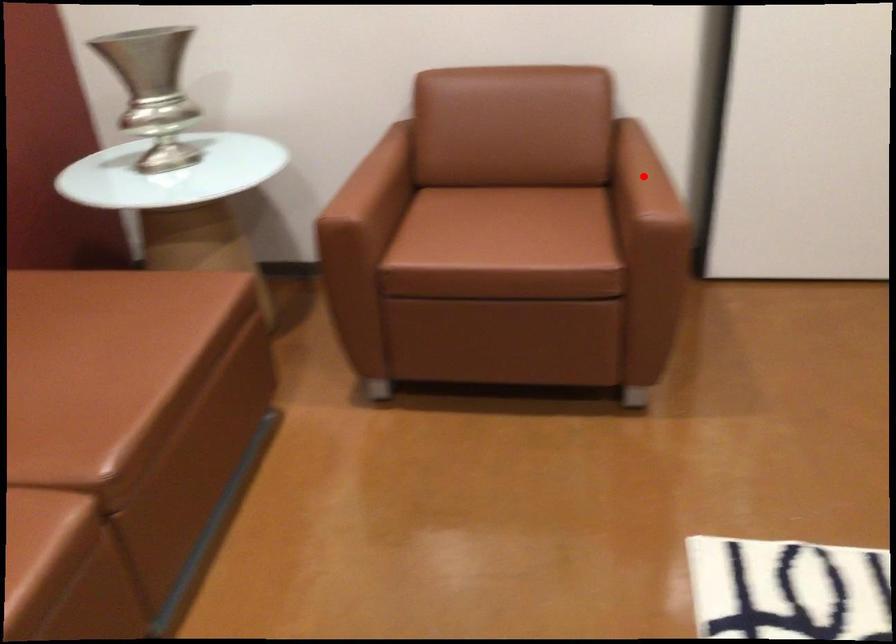
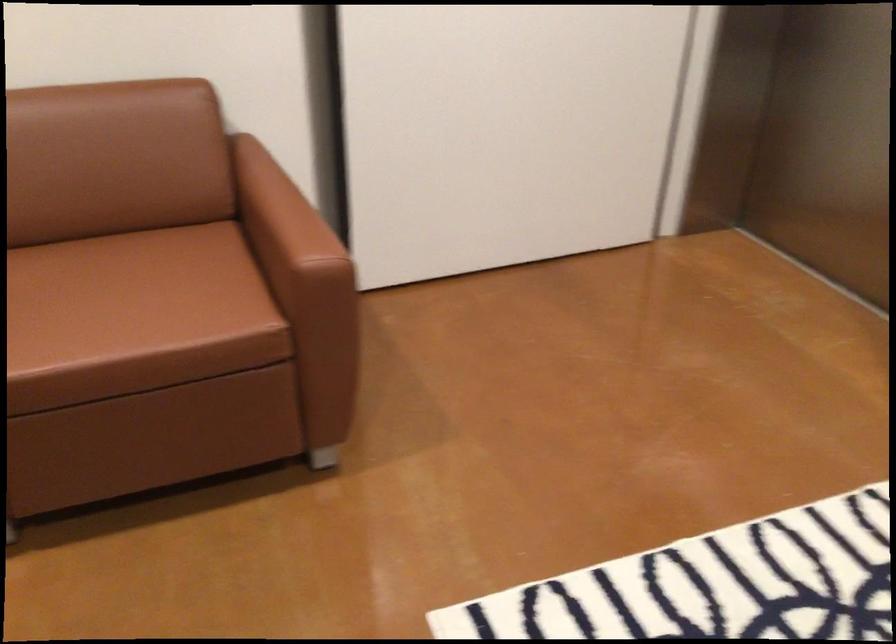
Question: I am providing you with two images of the same scene from different viewpoints. Image1 has a red point marked. In image2, the corresponding 3D location appears at what relative position? Reply with the corresponding letter.

Choices:
 (A) Closer
 (B) Farther

Answer: (A)